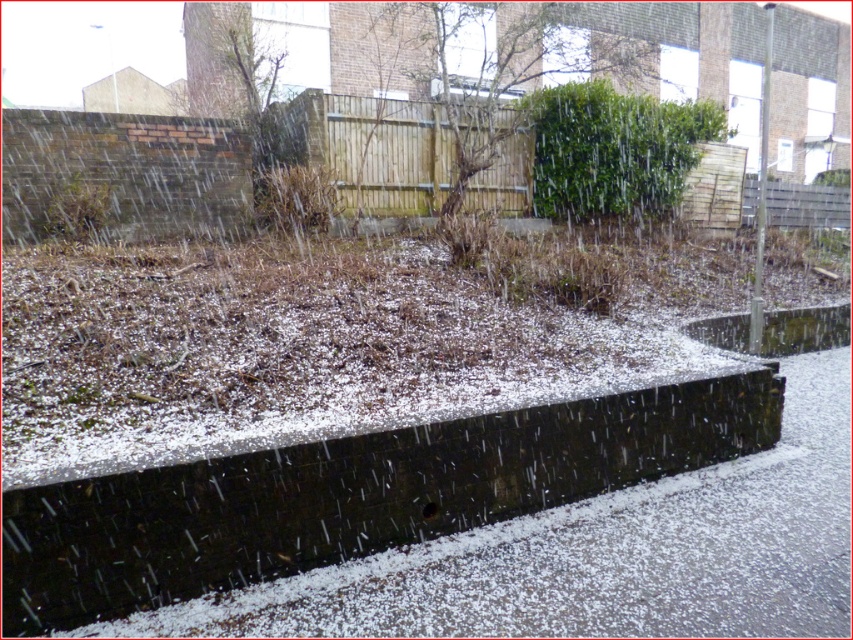
Question: Among these points, which one is farthest from the camera?

Choices:
 (A) (573, 403)
 (B) (549, 161)

Answer: (B)

Question: Is black concrete curb at lower center closer to camera compared to green leafy bush at upper center?

Choices:
 (A) no
 (B) yes

Answer: (B)

Question: Which of the following is the farthest from the observer?

Choices:
 (A) green leafy bush at upper center
 (B) green leafy tree at upper center

Answer: (A)

Question: Which point is farther to the camera?

Choices:
 (A) (105, 596)
 (B) (688, 132)
 (C) (480, 3)

Answer: (C)

Question: Can you confirm if green leafy tree at upper center is thinner than green leafy bush at upper center?

Choices:
 (A) yes
 (B) no

Answer: (B)

Question: Can you confirm if green leafy tree at upper center is bigger than green leafy bush at upper center?

Choices:
 (A) yes
 (B) no

Answer: (A)